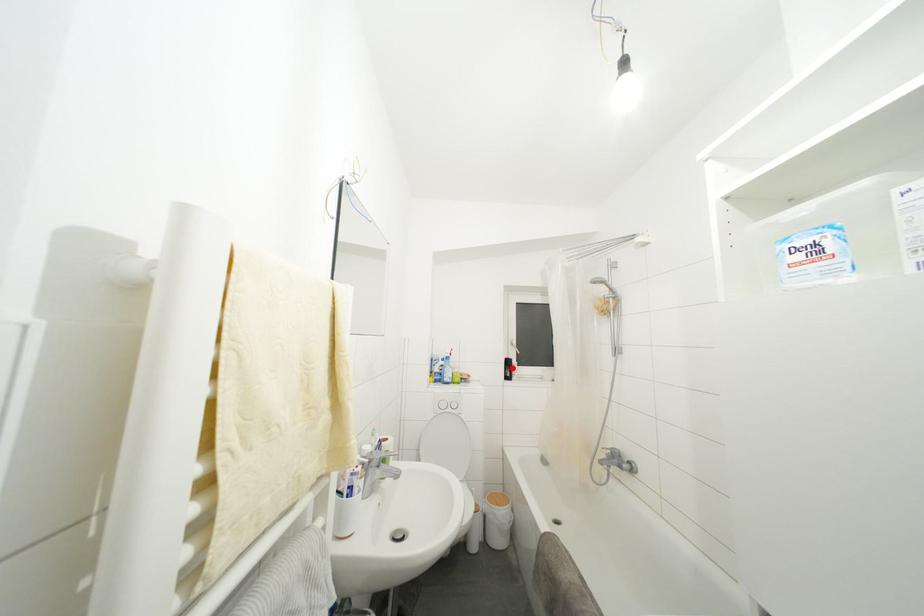
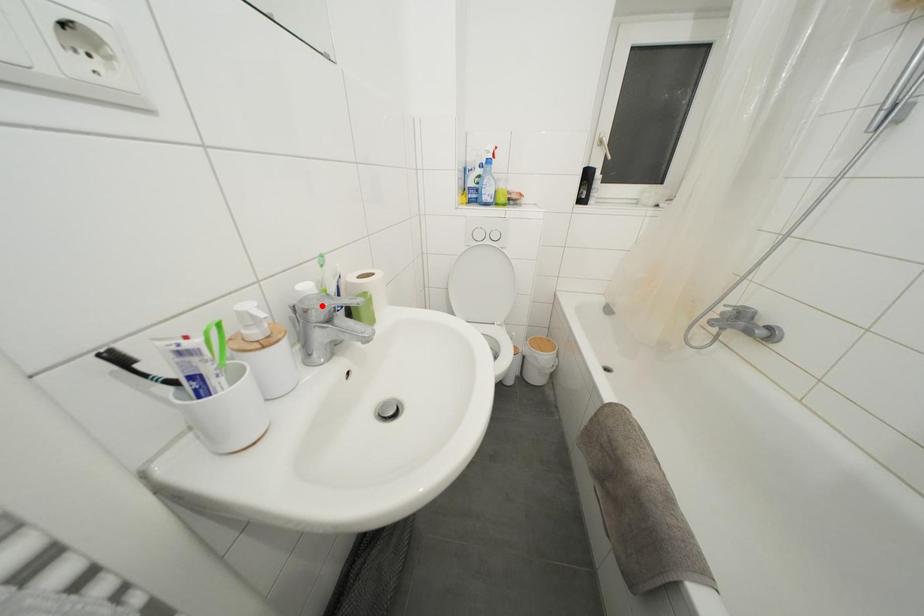
I am providing you with two images of the same scene from different viewpoints. A red point is marked on the first image and another point is marked on the second image. Is the marked point in image1 the same physical position as the marked point in image2?

No